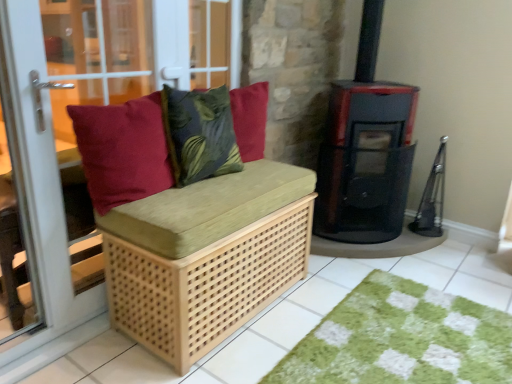
Locate an element on the screen. free space to the right of velvety green leaf-patterned pillow at center is located at coordinates (265, 175).